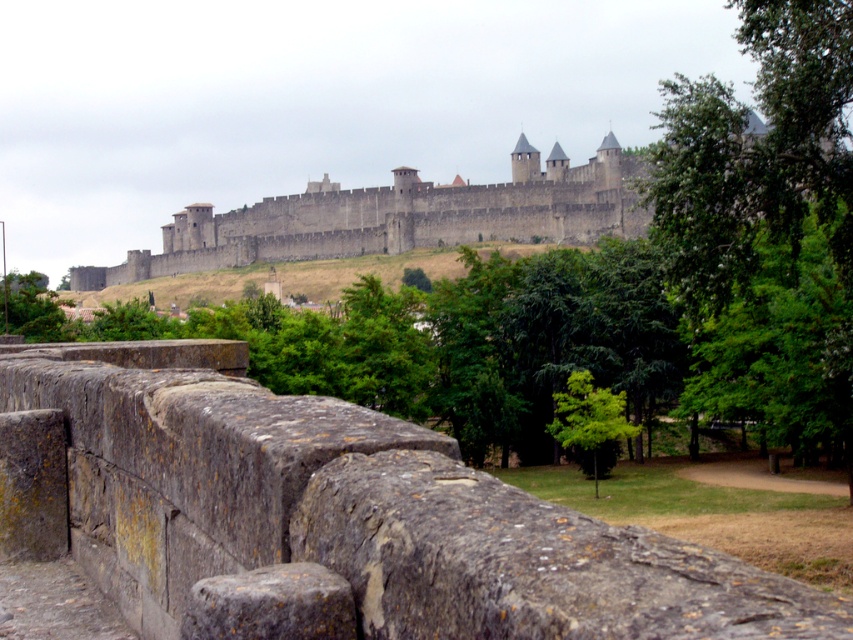
Based on the photo, you are a tourist standing in front of the stone wall in the historic city. You notice a rusty stone ledge at center and a green leafy tree at center. Which object is positioned higher relative to the other?

The rusty stone ledge at center is above the green leafy tree at center, so it is positioned higher.

You are a tourist standing at the base of the gray stone wall at upper center and want to take a photo of the rusty stone ledge at center. Which object should you focus on first to ensure both are in the frame?

You should focus on the gray stone wall at upper center first because the rusty stone ledge at center is in front of it, so adjusting focus starting from the closer object will help both be in the frame.

You are a tourist in the historic city and want to take a photo that includes both the green leafy tree at center and the green leafy tree at lower left. Which tree should you focus on to ensure both are in the frame without zooming in too much?

Focus on the green leafy tree at center because it is smaller in size compared to the green leafy tree at lower left, so positioning the camera to include the larger tree will naturally include the smaller one as well.